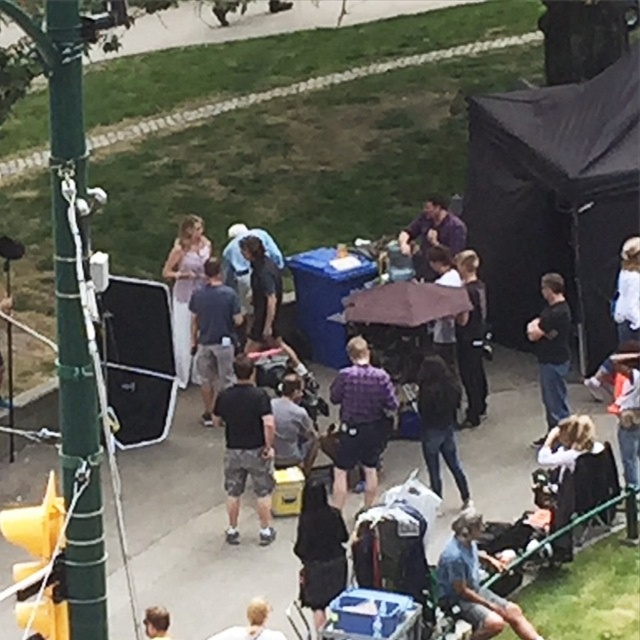
Who is more distant from viewer, (444, 416) or (564, 381)?

The point (564, 381) is more distant.

Does dark brown leather jacket at center have a greater width compared to black matte shirt at center?

Indeed, dark brown leather jacket at center has a greater width compared to black matte shirt at center.

Measure the distance between dark brown leather jacket at center and camera.

dark brown leather jacket at center and camera are 15.37 meters apart.

Where is `dark brown leather jacket at center`? This screenshot has width=640, height=640. dark brown leather jacket at center is located at coordinates coord(440,422).

Is light gray shirt at center thinner than dark gray shirt at center?

Incorrect, light gray shirt at center's width is not less than dark gray shirt at center's.

From the picture: Is light gray shirt at center taller than dark gray shirt at center?

In fact, light gray shirt at center may be shorter than dark gray shirt at center.

Which is in front, point (296, 460) or point (266, 326)?

Point (296, 460) is more forward.

Image resolution: width=640 pixels, height=640 pixels. Find the location of `light gray shirt at center`. light gray shirt at center is located at coordinates (292, 428).

Who is taller, purple plaid shirt at center or light gray shirt at center?

purple plaid shirt at center

Between purple plaid shirt at center and light gray shirt at center, which one appears on the left side from the viewer's perspective?

Positioned to the left is light gray shirt at center.

Is point (342, 490) positioned in front of point (278, 394)?

Yes, it is.

Image resolution: width=640 pixels, height=640 pixels. What are the coordinates of `purple plaid shirt at center` in the screenshot? It's located at (360, 419).